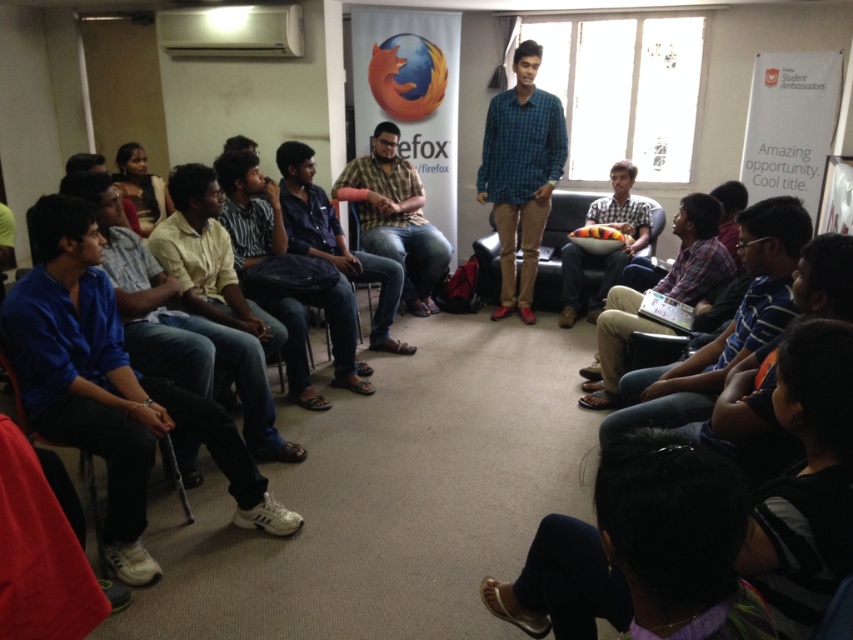
Question: Which point appears farthest from the camera in this image?

Choices:
 (A) (412, 307)
 (B) (222, 298)
 (C) (572, 276)
 (D) (277, 161)

Answer: (A)

Question: Is green checkered shirt at center wider than yellow shirt at center?

Choices:
 (A) no
 (B) yes

Answer: (A)

Question: Is green checkered shirt at center to the right of striped shirt at center from the viewer's perspective?

Choices:
 (A) no
 (B) yes

Answer: (B)

Question: Among these points, which one is nearest to the camera?

Choices:
 (A) (601, 221)
 (B) (538, 612)
 (C) (274, 428)
 (D) (521, 275)

Answer: (B)

Question: Can you confirm if purple fabric hairband at lower center is smaller than brown casual shirt at center?

Choices:
 (A) no
 (B) yes

Answer: (B)

Question: Which of the following is the closest to the observer?

Choices:
 (A) (308, 150)
 (B) (656, 518)
 (C) (370, 138)

Answer: (B)